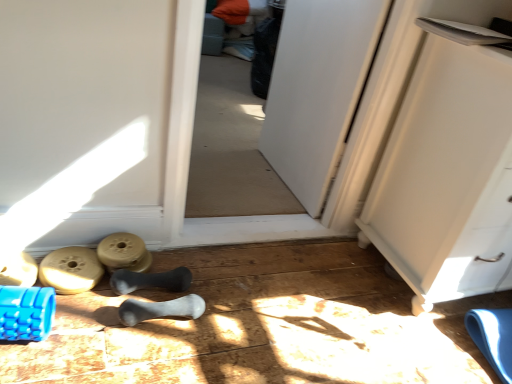
Identify the location of vacant space situated on the left part of gray rubber bone at center, arranged as the 4th footwear when viewed from the left. (85, 323).